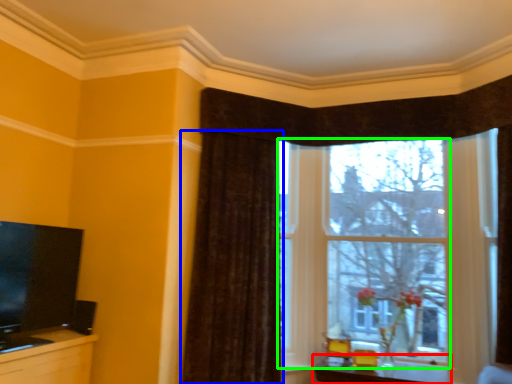
Question: Based on their relative distances, which object is nearer to table (highlighted by a red box)? Choose from curtain (highlighted by a blue box) and window (highlighted by a green box).

Choices:
 (A) curtain
 (B) window

Answer: (B)